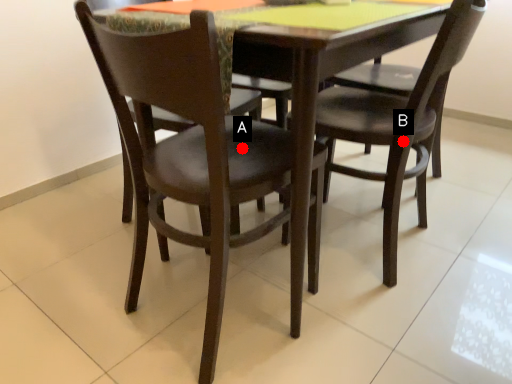
Question: Two points are circled on the image, labeled by A and B beside each circle. Which point is farther to the camera?

Choices:
 (A) A is further
 (B) B is further

Answer: (B)